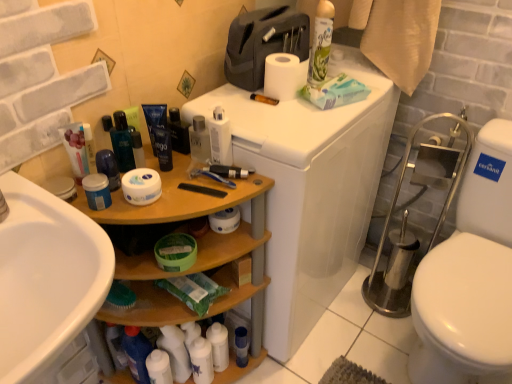
What are the coordinates of `white glossy sink at left` in the screenshot? It's located at pyautogui.click(x=46, y=277).

How much space does white glossy lotion at upper center, the 11th toiletry when ordered from left to right, occupy vertically?

The height of white glossy lotion at upper center, the 11th toiletry when ordered from left to right, is 6.73 inches.

What do you see at coordinates (241, 346) in the screenshot? I see `blue plastic cup at lower center, placed as the first toiletry when sorted from right to left` at bounding box center [241, 346].

This screenshot has height=384, width=512. What are the coordinates of `blue matte shaving cream at center, the 6th toiletry from the right` in the screenshot? It's located at (163, 148).

This screenshot has width=512, height=384. What do you see at coordinates (163, 148) in the screenshot?
I see `blue matte shaving cream at center, the 6th toiletry from the right` at bounding box center [163, 148].

Locate an element on the screen. white glossy sink at left is located at coordinates (46, 277).

Is green matte spray can at upper right not close to shiny black bottle at center, marked as the 8th toiletry in a left-to-right arrangement?

green matte spray can at upper right is actually quite close to shiny black bottle at center, marked as the 8th toiletry in a left-to-right arrangement.

Which object is more forward, green matte spray can at upper right or shiny black bottle at center, the 5th toiletry in the right-to-left sequence?

shiny black bottle at center, the 5th toiletry in the right-to-left sequence, is more forward.

Which object is wider, green matte spray can at upper right or shiny black bottle at center, the 5th toiletry in the right-to-left sequence?

green matte spray can at upper right is wider.

Could you tell me if green matte spray can at upper right is facing shiny black bottle at center, marked as the 8th toiletry in a left-to-right arrangement?

No, green matte spray can at upper right is not turned towards shiny black bottle at center, marked as the 8th toiletry in a left-to-right arrangement.

Which object is further away from the camera taking this photo, wooden shelf at left or white matte toilet paper at upper center?

white matte toilet paper at upper center is behind.

Based on the photo, between wooden shelf at left and white matte toilet paper at upper center, which one appears on the left side from the viewer's perspective?

From the viewer's perspective, wooden shelf at left appears more on the left side.

In terms of height, does wooden shelf at left look taller or shorter compared to white matte toilet paper at upper center?

In the image, wooden shelf at left appears to be taller than white matte toilet paper at upper center.

How different are the orientations of wooden shelf at left and white matte toilet paper at upper center in degrees?

5.55 degrees separate the facing orientations of wooden shelf at left and white matte toilet paper at upper center.

Is blue matte tube at center, the eighth toiletry in the right-to-left sequence, touching white matte toilet paper at upper center?

No, blue matte tube at center, the eighth toiletry in the right-to-left sequence, is not touching white matte toilet paper at upper center.

Does blue matte tube at center, the eighth toiletry in the right-to-left sequence, turn towards white matte toilet paper at upper center?

No, blue matte tube at center, the eighth toiletry in the right-to-left sequence, is not turned towards white matte toilet paper at upper center.

Can you confirm if blue matte tube at center, placed as the 5th toiletry when sorted from left to right, is wider than white matte toilet paper at upper center?

No, blue matte tube at center, placed as the 5th toiletry when sorted from left to right, is not wider than white matte toilet paper at upper center.

Who is taller, blue matte tube at center, the eighth toiletry in the right-to-left sequence, or white matte toilet paper at upper center?

blue matte tube at center, the eighth toiletry in the right-to-left sequence, is taller.

Locate an element on the screen. the 9th toiletry above when counting from the white glossy bottle at lower center, the fourth toiletry when ordered from right to left (from the image's perspective) is located at coordinates (159, 133).

Based on their positions, is blue matte tube at center, placed as the 5th toiletry when sorted from left to right, located to the left or right of white glossy bottle at lower center, which is counted as the 9th toiletry, starting from the left?

Based on their positions, blue matte tube at center, placed as the 5th toiletry when sorted from left to right, is located to the left of white glossy bottle at lower center, which is counted as the 9th toiletry, starting from the left.

Looking at this image, can you confirm if blue matte tube at center, placed as the 5th toiletry when sorted from left to right, is smaller than white glossy bottle at lower center, the fourth toiletry when ordered from right to left?

Correct, blue matte tube at center, placed as the 5th toiletry when sorted from left to right, occupies less space than white glossy bottle at lower center, the fourth toiletry when ordered from right to left.

Does blue matte tube at center, placed as the 5th toiletry when sorted from left to right, have a greater height compared to white glossy bottle at lower center, the fourth toiletry when ordered from right to left?

No.

Locate an element on the screen. The width and height of the screenshot is (512, 384). cleaning product in front of the white glossy lotion at lower center, which ranks as the sixth toiletry in left-to-right order is located at coordinates (321, 43).

Relative to white glossy lotion at lower center, which ranks as the sixth toiletry in left-to-right order, is green matte spray can at upper right in front or behind?

In the image, green matte spray can at upper right appears in front of white glossy lotion at lower center, which ranks as the sixth toiletry in left-to-right order.

Is matte blue jar at center, placed as the tenth toiletry when sorted from right to left, shorter than white matte toilet paper at upper center?

Correct, matte blue jar at center, placed as the tenth toiletry when sorted from right to left, is not as tall as white matte toilet paper at upper center.

From the image's perspective, would you say matte blue jar at center, positioned as the 3th toiletry in left-to-right order, is positioned over white matte toilet paper at upper center?

No, from the image's perspective, matte blue jar at center, positioned as the 3th toiletry in left-to-right order, is not on top of white matte toilet paper at upper center.

How different are the orientations of matte blue jar at center, placed as the tenth toiletry when sorted from right to left, and white matte toilet paper at upper center in degrees?

The facing directions of matte blue jar at center, placed as the tenth toiletry when sorted from right to left, and white matte toilet paper at upper center are 5 degrees apart.

From the picture: Between matte blue jar at center, placed as the tenth toiletry when sorted from right to left, and white matte toilet paper at upper center, which one appears on the right side from the viewer's perspective?

white matte toilet paper at upper center.

Considering the relative sizes of blue matte tube at center, the eighth toiletry in the right-to-left sequence, and green matte spray can at upper right in the image provided, is blue matte tube at center, the eighth toiletry in the right-to-left sequence, thinner than green matte spray can at upper right?

Indeed, blue matte tube at center, the eighth toiletry in the right-to-left sequence, has a lesser width compared to green matte spray can at upper right.

From the image's perspective, is blue matte tube at center, placed as the 5th toiletry when sorted from left to right, positioned above or below green matte spray can at upper right?

blue matte tube at center, placed as the 5th toiletry when sorted from left to right, is below green matte spray can at upper right.

How distant is blue matte tube at center, placed as the 5th toiletry when sorted from left to right, from green matte spray can at upper right?

blue matte tube at center, placed as the 5th toiletry when sorted from left to right, is 18.45 inches away from green matte spray can at upper right.

Who is taller, blue matte tube at center, placed as the 5th toiletry when sorted from left to right, or green matte spray can at upper right?

With more height is green matte spray can at upper right.

From the image's perspective, count 1st toiletrys downward from the green matte spray can at upper right and point to it. Please provide its 2D coordinates.

[(178, 132)]

Locate an element on the screen. This screenshot has height=384, width=512. counter in front of the white matte toilet paper at upper center is located at coordinates (198, 254).

Based on their spatial positions, is white glossy bottle at lower center, the 3th toiletry when ordered from right to left, or white glossy bottle at lower center, the fourth toiletry when ordered from right to left, further from white glossy lotion at lower center, which is the 7th toiletry from right to left?

white glossy bottle at lower center, the 3th toiletry when ordered from right to left.

Looking at the image, which one is located closer to green matte spray can at upper right, white glossy bottle at lower center, which is the tenth toiletry from left to right, or white glossy lotion at lower center, which is the 7th toiletry from right to left?

Among the two, white glossy bottle at lower center, which is the tenth toiletry from left to right, is located nearer to green matte spray can at upper right.

Based on their spatial positions, is blue matte tube at center, the eighth toiletry in the right-to-left sequence, or blue matte shaving cream at center, which is the 7th toiletry from left to right, closer to matte white tube at upper left, placed as the 12th toiletry when sorted from right to left?

blue matte tube at center, the eighth toiletry in the right-to-left sequence, is closer to matte white tube at upper left, placed as the 12th toiletry when sorted from right to left.

Looking at this image, when comparing their distances from white glossy sink at left, does shiny black bottle at center, the 5th toiletry in the right-to-left sequence, or matte white tube at upper left, arranged as the 1th toiletry when viewed from the left, seem further?

shiny black bottle at center, the 5th toiletry in the right-to-left sequence, lies further to white glossy sink at left than the other object.

From the image, which object appears to be nearer to white glossy bottle at lower left, the 4th toiletry from the left, white plastic toilet at upper right or blue matte tube at center, the eighth toiletry in the right-to-left sequence?

blue matte tube at center, the eighth toiletry in the right-to-left sequence.

Considering their positions, is shiny black bottle at center, the 5th toiletry in the right-to-left sequence, positioned closer to shiny blue bottle at center than blue matte shaving cream at center, the 6th toiletry from the right?

blue matte shaving cream at center, the 6th toiletry from the right, is positioned closer to the anchor shiny blue bottle at center.

Considering their positions, is green matte spray can at upper right positioned closer to blue plastic cup at lower center, placed as the first toiletry when sorted from right to left, than white glossy lotion at upper center, which is the second toiletry in right-to-left order?

white glossy lotion at upper center, which is the second toiletry in right-to-left order, lies closer to blue plastic cup at lower center, placed as the first toiletry when sorted from right to left, than the other object.

Which object lies nearer to the anchor point white glossy bottle at lower left, arranged as the ninth toiletry when viewed from the right, white glossy bottle at lower center, the fourth toiletry when ordered from right to left, or blue plastic cup at lower center, the 12th toiletry viewed from the left?

white glossy bottle at lower center, the fourth toiletry when ordered from right to left, is positioned closer to the anchor white glossy bottle at lower left, arranged as the ninth toiletry when viewed from the right.

Identify the location of appliance that lies between blue matte jar at left, which ranks as the 2th toiletry in left-to-right order, and white glossy bottle at lower center, which is the tenth toiletry from left to right, from top to bottom. (310, 190).

In order to click on product between green matte spray can at upper right and white plastic toilet at upper right in the up-down direction in this screenshot , I will do `click(335, 92)`.

Locate an element on the screen. This screenshot has height=384, width=512. mouthwash between shiny black bottle at center, marked as the 8th toiletry in a left-to-right arrangement, and white glossy bottle at lower left, the 4th toiletry from the left, in the up-down direction is located at coordinates pos(122,143).

Locate an element on the screen. This screenshot has width=512, height=384. counter that lies between white glossy lotion at upper center, which is the second toiletry in right-to-left order, and white glossy bottle at lower center, which is counted as the 9th toiletry, starting from the left, from top to bottom is located at coordinates (198, 254).